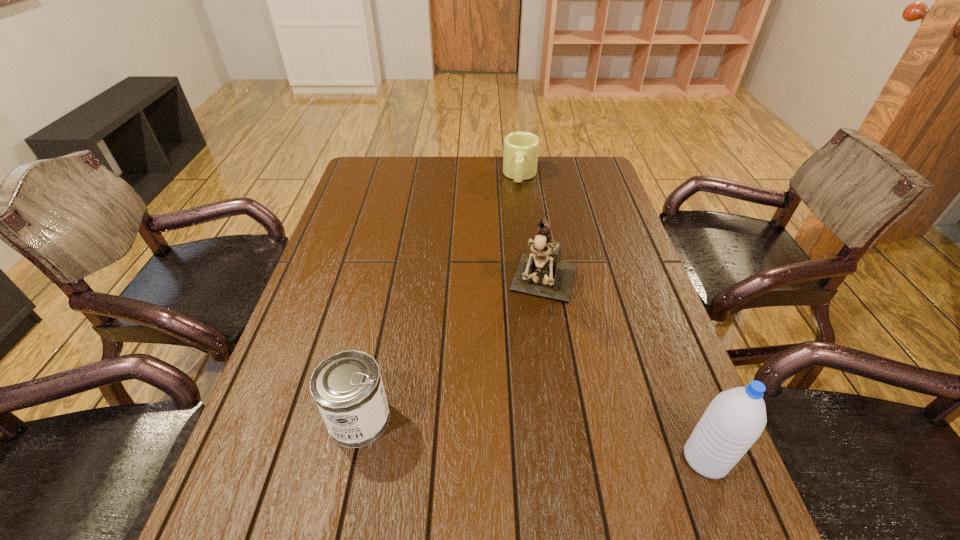
The height and width of the screenshot is (540, 960). In order to click on free location located 0.330m with the handle on the side of the farthest object in this screenshot , I will do `click(513, 248)`.

The height and width of the screenshot is (540, 960). In order to click on vacant space located on the front-facing side of the tallest object in this screenshot , I will do `click(526, 371)`.

The width and height of the screenshot is (960, 540). I want to click on blank area located on the front-facing side of the tallest object, so click(x=512, y=423).

The image size is (960, 540). Identify the location of vacant space located 0.390m on the front-facing side of the tallest object. (496, 475).

Find the location of a particular element. This screenshot has height=540, width=960. object located in the far edge section of the desktop is located at coordinates (521, 149).

Locate an element on the screen. The image size is (960, 540). can present at the near edge is located at coordinates [x=347, y=387].

At what (x,y) coordinates should I click in order to perform the action: click on water bottle positioned at the near edge. Please return your answer as a coordinate pair (x, y). This screenshot has height=540, width=960. Looking at the image, I should click on (734, 420).

This screenshot has height=540, width=960. In order to click on object present at the left edge in this screenshot , I will do `click(347, 387)`.

Locate an element on the screen. object positioned at the right edge is located at coordinates (734, 420).

Locate an element on the screen. This screenshot has width=960, height=540. object at the near left corner is located at coordinates (347, 387).